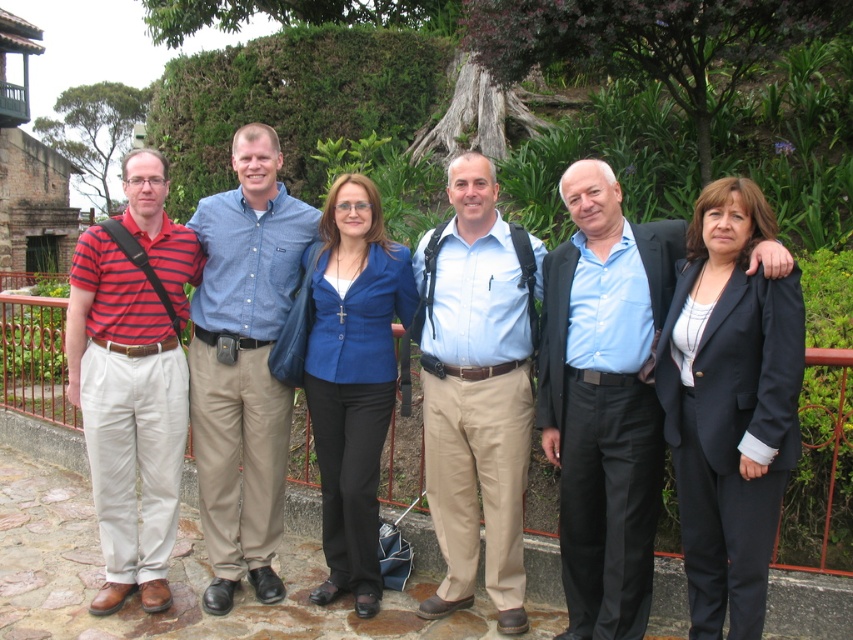
Based on the photo, you are organizing a group photo and need to ensure that the two central individuals wearing the matte blue blazer at center and the light blue shirt at center can stand side by side without overlapping their clothing. Based on the scene description, which individual requires more space due to their clothing width?

The matte blue blazer at center requires more space because its width is larger than the light blue shirt at center.

Based on the photo, you are a photographer trying to capture a group photo of the blue shirt at center and the striped cotton polo shirt at left. Since you want to ensure both subjects are in focus, you need to know which one is closer to the camera. Based on their positions in the image, can you determine which one is nearer?

The blue shirt at center is thinner than striped cotton polo shirt at left, which indicates it is closer to the camera.

You are a photographer trying to capture a group photo of the matte blue blazer at center and the blue shirt at center. Which of the two should you focus on first if you want to ensure both are in frame without moving the camera?

The matte blue blazer at center is wider than the blue shirt at center, so focusing on the matte blue blazer at center first will ensure the blue shirt at center is also in frame.